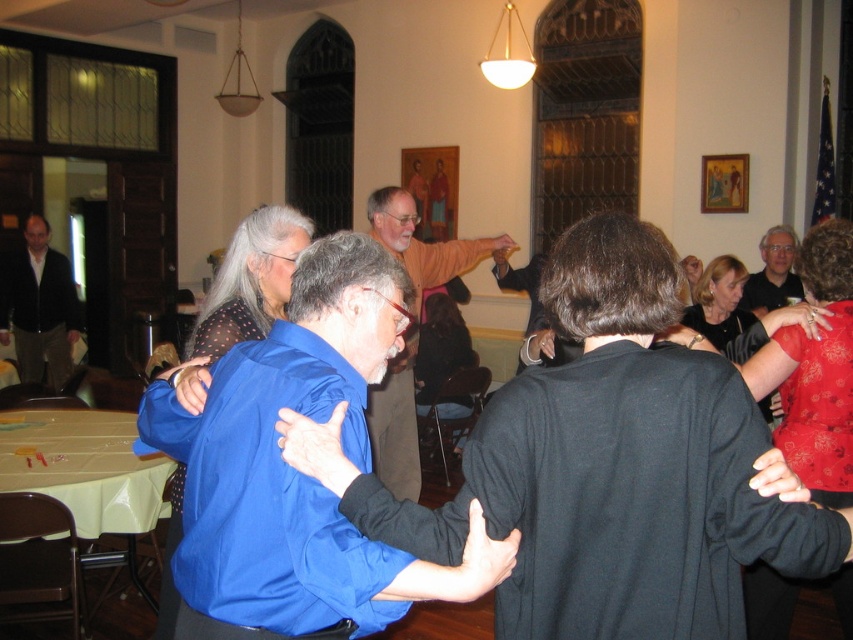
Question: Is blue satin shirt at center positioned before matte black shirt at upper right?

Choices:
 (A) yes
 (B) no

Answer: (A)

Question: Is blue satin shirt at center positioned in front of matte black jacket at left?

Choices:
 (A) yes
 (B) no

Answer: (A)

Question: Which object appears closest to the camera in this image?

Choices:
 (A) matte black jacket at left
 (B) orange cotton shirt at center
 (C) blue satin shirt at center

Answer: (C)

Question: Which of the following is the closest to the observer?

Choices:
 (A) orange cotton shirt at center
 (B) matte black jacket at left

Answer: (A)

Question: Which of the following is the farthest from the observer?

Choices:
 (A) (757, 284)
 (B) (38, 320)

Answer: (B)

Question: In this image, where is orange cotton shirt at center located relative to matte black shirt at upper right?

Choices:
 (A) above
 (B) below

Answer: (B)